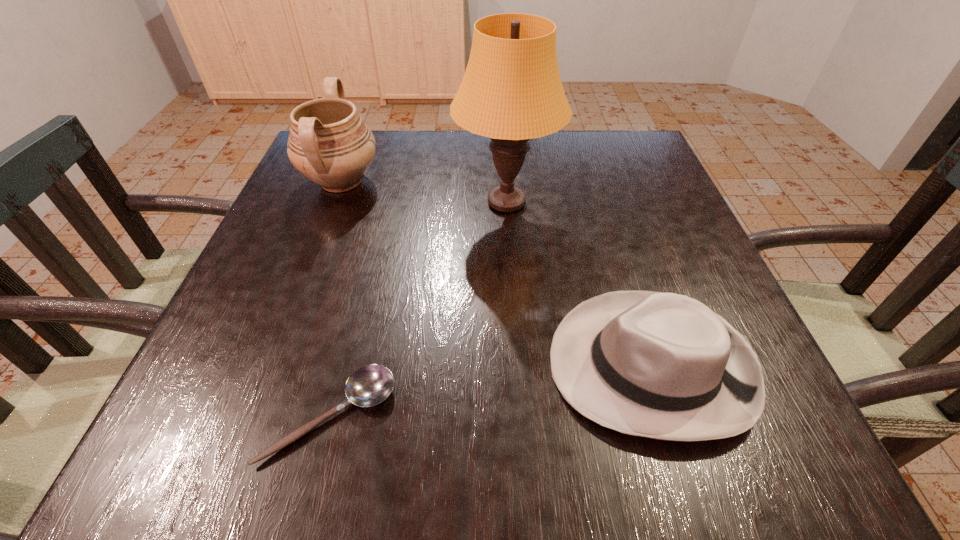
Identify the location of lampshade positioned at the far edge. (511, 92).

Where is `urn that is at the far edge`? This screenshot has height=540, width=960. urn that is at the far edge is located at coordinates (329, 143).

Image resolution: width=960 pixels, height=540 pixels. In order to click on fedora that is at the near edge in this screenshot , I will do `click(660, 365)`.

Find the location of a particular element. ladle that is at the near edge is located at coordinates (369, 385).

Where is `urn located in the left edge section of the desktop`? The height and width of the screenshot is (540, 960). urn located in the left edge section of the desktop is located at coordinates (329, 143).

This screenshot has width=960, height=540. What are the coordinates of `ladle that is at the left edge` in the screenshot? It's located at (369, 385).

This screenshot has width=960, height=540. Find the location of `object situated at the right edge`. object situated at the right edge is located at coordinates (660, 365).

Where is `object located at the far left corner`? object located at the far left corner is located at coordinates (329, 143).

Where is `object positioned at the near left corner`? Image resolution: width=960 pixels, height=540 pixels. object positioned at the near left corner is located at coordinates (369, 385).

Where is `object that is at the near right corner`? The width and height of the screenshot is (960, 540). object that is at the near right corner is located at coordinates (660, 365).